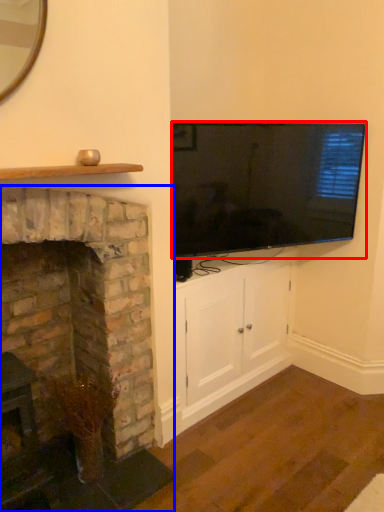
Question: Among these objects, which one is nearest to the camera, television (highlighted by a red box) or fireplace (highlighted by a blue box)?

Choices:
 (A) television
 (B) fireplace

Answer: (B)